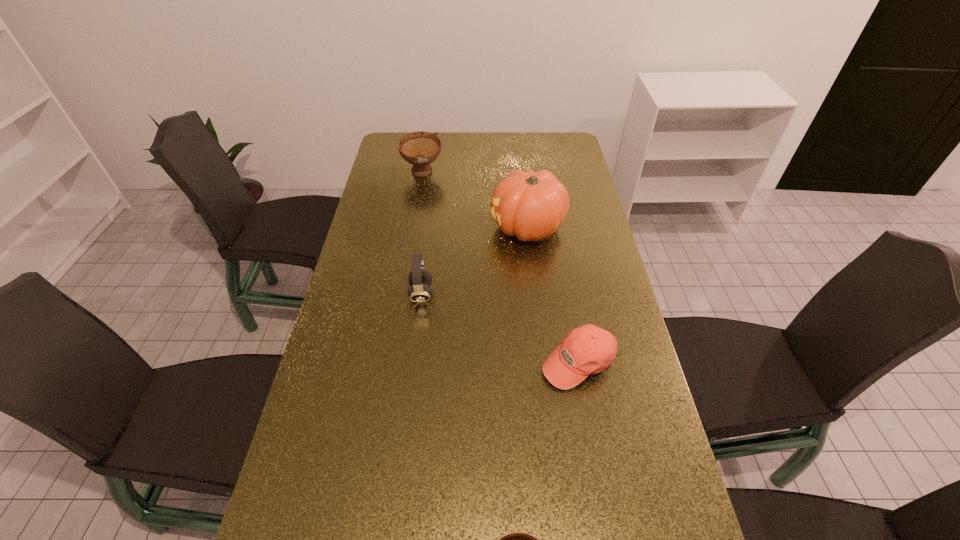
Where is `the fourth nearest object`? Image resolution: width=960 pixels, height=540 pixels. the fourth nearest object is located at coordinates (530, 205).

Locate an element on the screen. pumpkin is located at coordinates (530, 205).

Locate an element on the screen. The image size is (960, 540). the farthest object is located at coordinates (420, 148).

Find the location of a particular element. the farther soup bowl is located at coordinates (420, 148).

The height and width of the screenshot is (540, 960). In order to click on the third nearest object in this screenshot , I will do pos(420,279).

Image resolution: width=960 pixels, height=540 pixels. What are the coordinates of `baseball cap` in the screenshot? It's located at (588, 349).

Identify the location of the fourth tallest object. This screenshot has height=540, width=960. (588, 349).

Where is `vacant position located on the carved face of the pumpkin`? The width and height of the screenshot is (960, 540). vacant position located on the carved face of the pumpkin is located at coordinates (395, 228).

Where is `vacant space situated 0.370m on the carved face of the pumpkin`? This screenshot has width=960, height=540. vacant space situated 0.370m on the carved face of the pumpkin is located at coordinates (383, 228).

Locate an element on the screen. vacant area situated 0.220m on the carved face of the pumpkin is located at coordinates (426, 228).